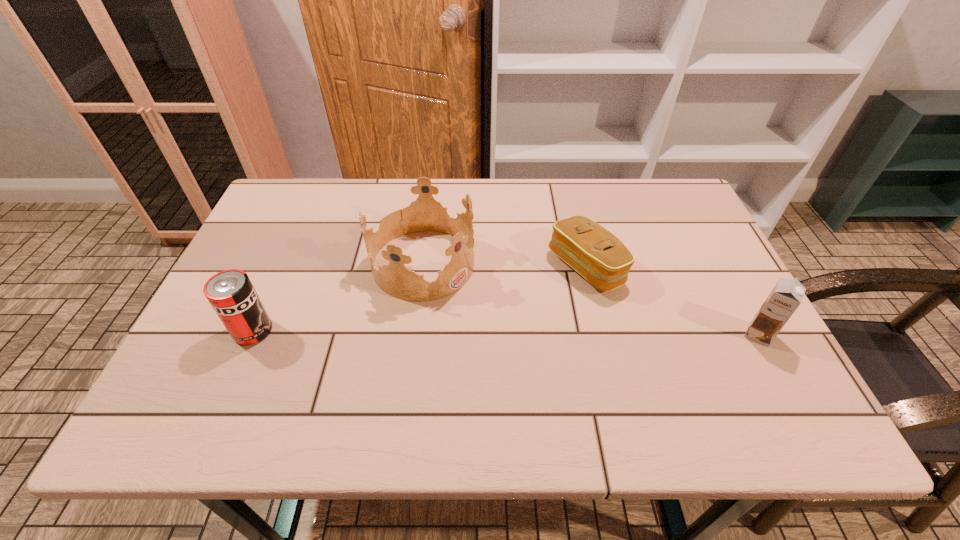
Locate an element on the screen. This screenshot has width=960, height=540. vacant point located between the rightmost object and the can is located at coordinates (506, 333).

I want to click on vacant space in between the leftmost object and the third object from right to left, so click(339, 297).

Where is `vacant area between the tiara and the rightmost object`? vacant area between the tiara and the rightmost object is located at coordinates (591, 299).

Identify the location of unoccupied area between the rightmost object and the clutch bag. (672, 301).

This screenshot has width=960, height=540. What are the coordinates of `vacant area between the leftmost object and the chocolate milk` in the screenshot? It's located at (506, 333).

You are a GUI agent. You are given a task and a screenshot of the screen. Output one action in this format:
    pyautogui.click(x=<x>, y=<y>)
    Task: Click on the free space between the leftmost object and the tiara
    Image resolution: width=960 pixels, height=540 pixels.
    Given the screenshot: What is the action you would take?
    pyautogui.click(x=339, y=297)

This screenshot has height=540, width=960. Identify the location of free spot between the chocolate milk and the clutch bag. (672, 301).

Where is `vacant space that's between the third object from left to right and the tiara`? Image resolution: width=960 pixels, height=540 pixels. vacant space that's between the third object from left to right and the tiara is located at coordinates (505, 265).

Find the location of a particular element. The height and width of the screenshot is (540, 960). free space between the tiara and the clutch bag is located at coordinates 505,265.

Locate an element on the screen. vacant point located between the can and the rightmost object is located at coordinates (506, 333).